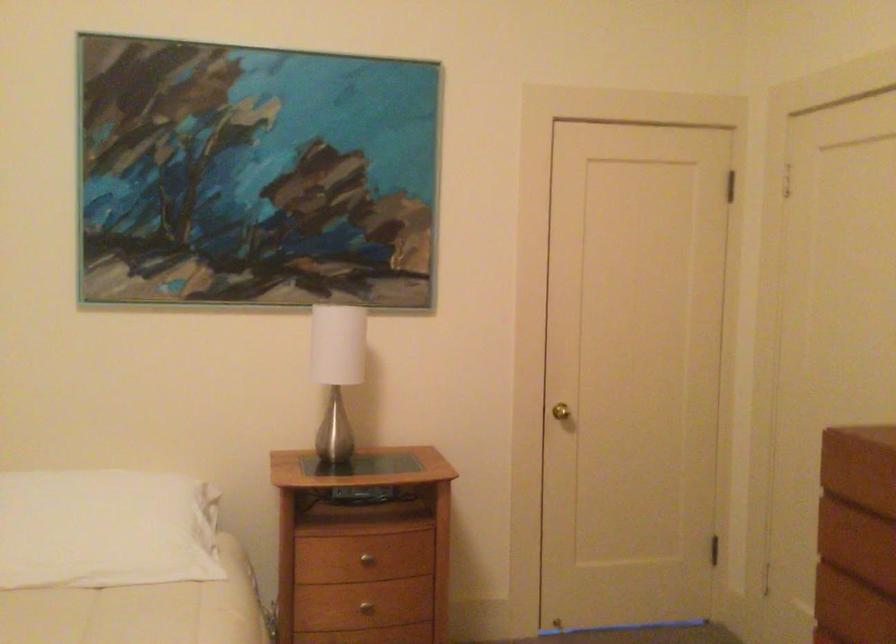
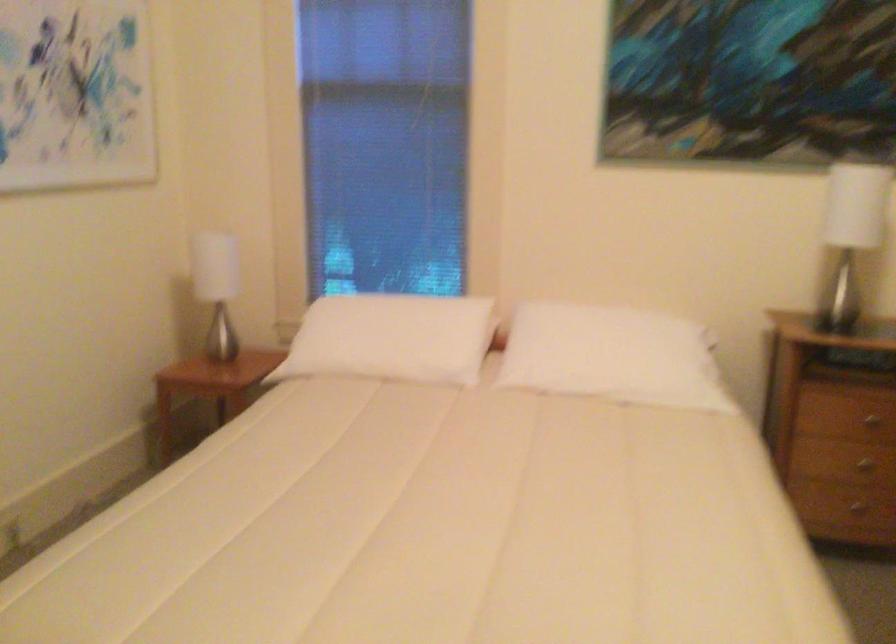
Question: The first image is from the beginning of the video and the second image is from the end. How did the camera likely rotate when shooting the video?

Choices:
 (A) Left
 (B) Right
 (C) Up
 (D) Down

Answer: (A)